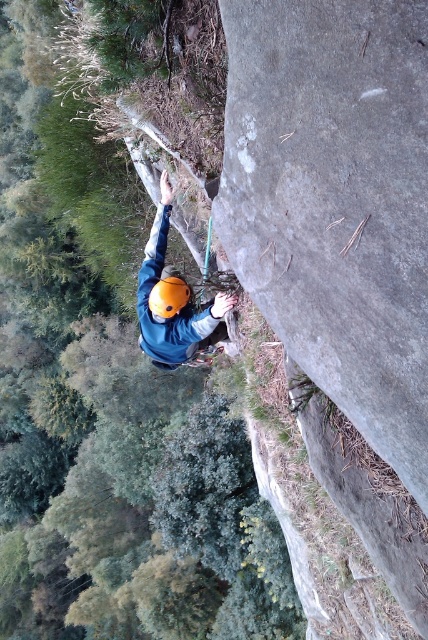
You are a safety officer assessing the climber in the image. The safety protocol requires that the distance between the climber and the observer must be at least 5 meters to avoid accidental rope contact. Is the distance between the matte blue jacket at center and the viewer sufficient according to the protocol?

The distance between the matte blue jacket at center and the viewer is 4.94 meters, which is less than the required 5 meters. Therefore, the distance does not meet the safety protocol requirement.

You are a safety inspector reviewing a rock climbing setup. You notice the climber has a matte blue jacket at center and an orange matte helmet at center. Based on the image, is the jacket covering the helmet properly for visibility purposes?

The matte blue jacket at center is positioned over the orange matte helmet at center, which may reduce visibility of the helmet and could be a safety concern.

You are a safety inspector analyzing the rock climber in the image. The climber is wearing a matte blue jacket at center and an orange matte helmet at center. Based on the distance between these two items, can you determine if the climber is properly wearing the helmet?

The matte blue jacket at center is 10.52 inches away from orange matte helmet at center. This distance suggests the helmet is positioned correctly on the climber, as it is appropriately spaced from the jacket to cover the head safely.